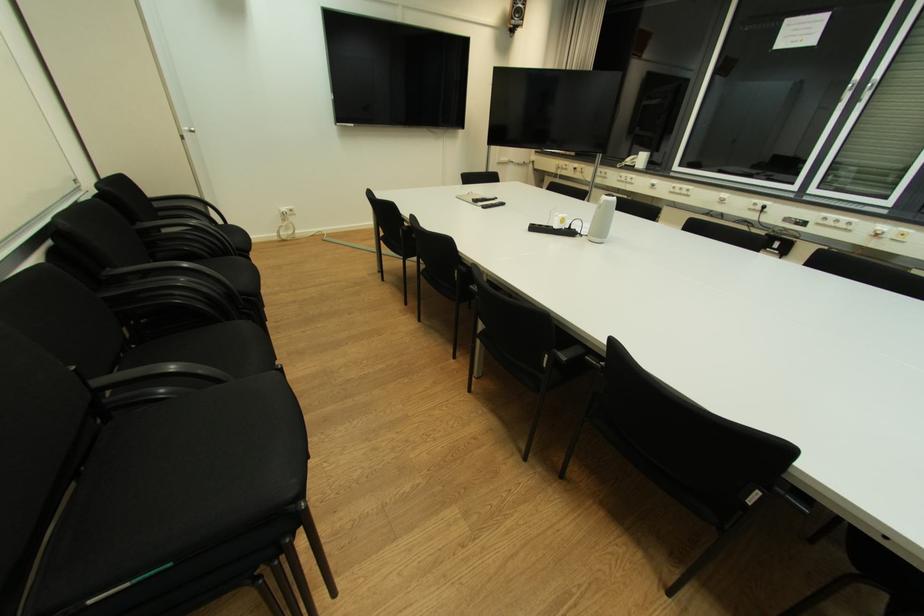
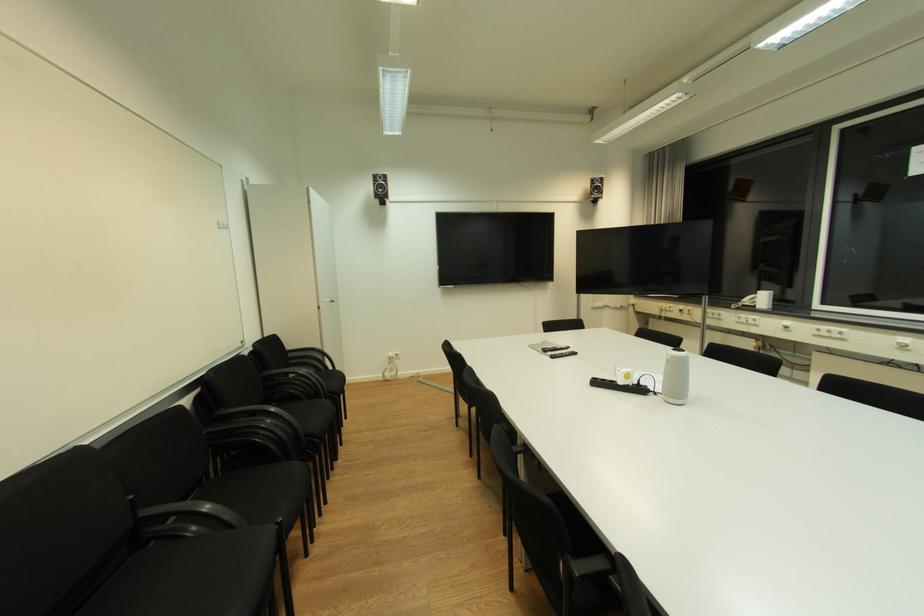
In the second image, find the point that corresponds to pixel 237 257 in the first image.

(325, 400)